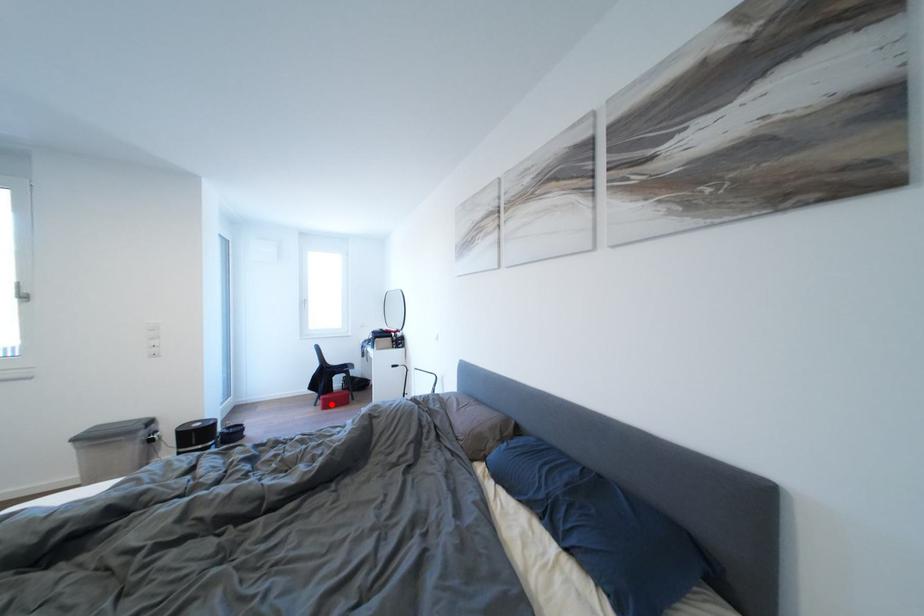
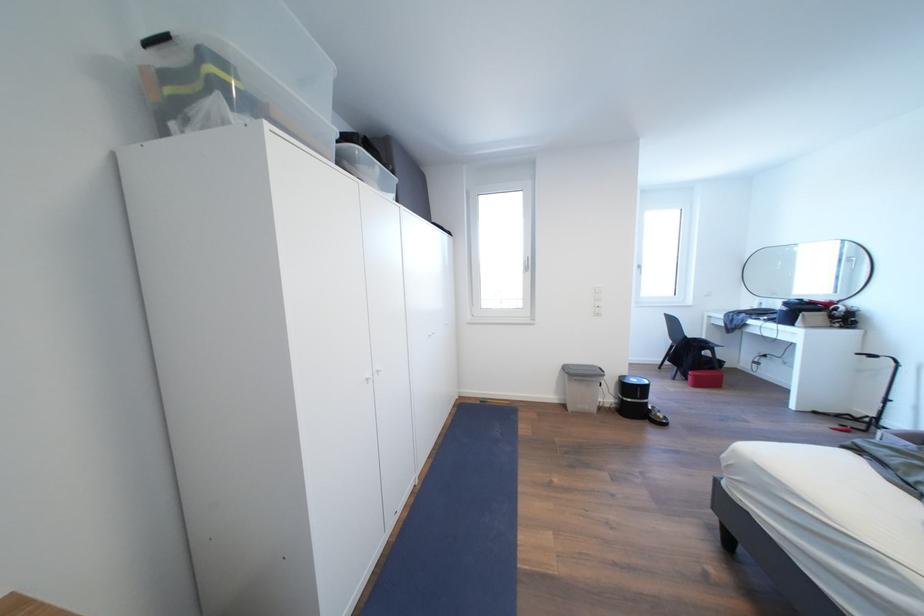
Find the pixel in the second image that matches the highlighted location in the first image.

(703, 381)